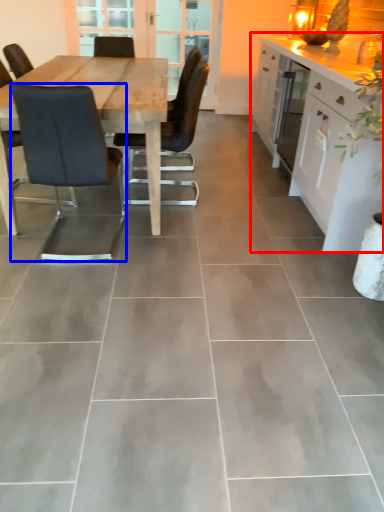
Question: Which object is closer to the camera taking this photo, cabinetry (highlighted by a red box) or chair (highlighted by a blue box)?

Choices:
 (A) cabinetry
 (B) chair

Answer: (B)